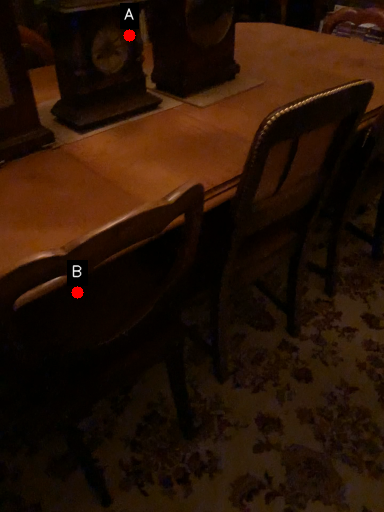
Question: Two points are circled on the image, labeled by A and B beside each circle. Which point appears farthest from the camera in this image?

Choices:
 (A) A is further
 (B) B is further

Answer: (A)